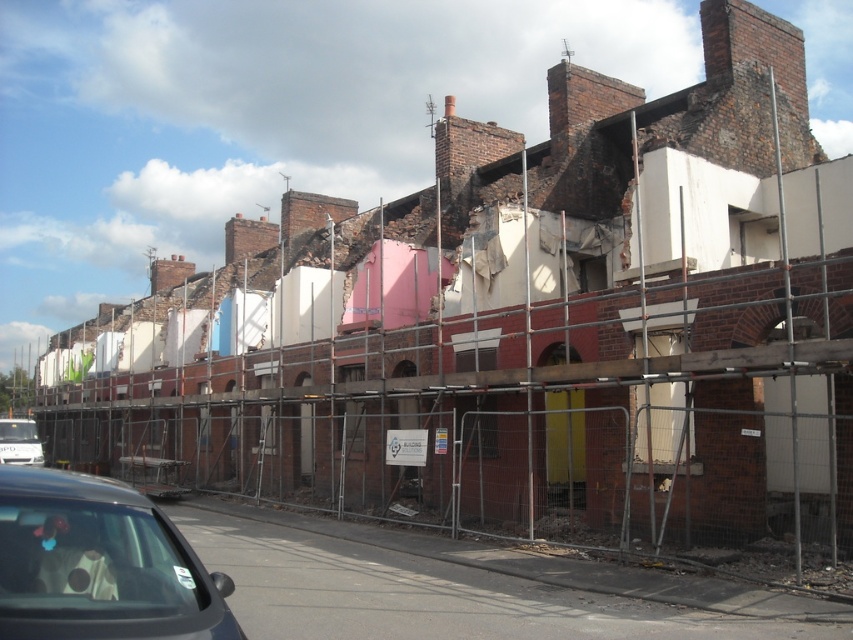
Question: Is black glossy car at lower left to the right of white matte van at lower left from the viewer's perspective?

Choices:
 (A) no
 (B) yes

Answer: (B)

Question: Is black glossy car at lower left bigger than white matte van at lower left?

Choices:
 (A) no
 (B) yes

Answer: (A)

Question: Does black glossy car at lower left have a greater width compared to white matte van at lower left?

Choices:
 (A) no
 (B) yes

Answer: (A)

Question: Which of the following is the farthest from the observer?

Choices:
 (A) black glossy car at lower left
 (B) white matte van at lower left

Answer: (B)